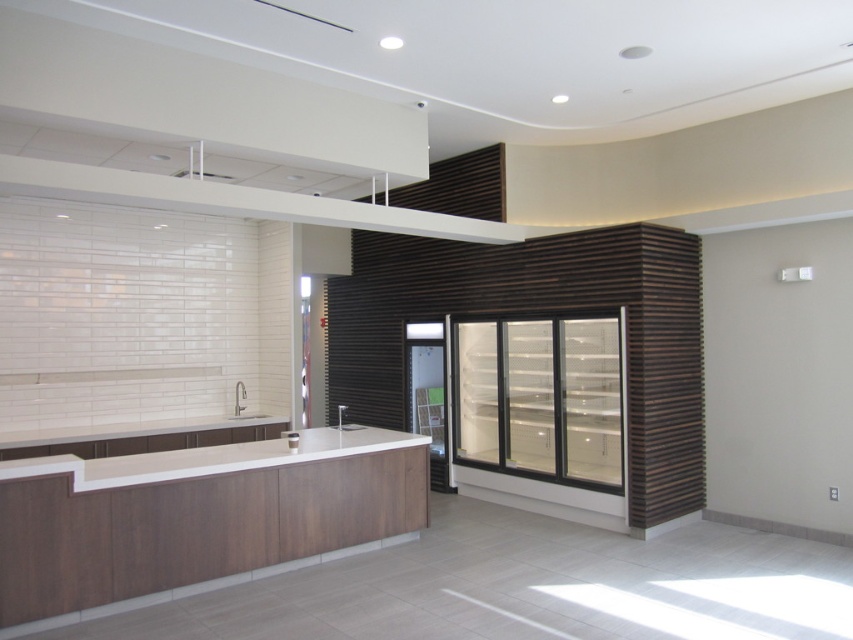
Question: Does clear glass refrigerator at center have a smaller size compared to white glossy sink at center?

Choices:
 (A) no
 (B) yes

Answer: (A)

Question: In this image, where is white matte countertop at center located relative to white glossy countertop at center?

Choices:
 (A) left
 (B) right

Answer: (A)

Question: Does white matte countertop at center appear under white glossy sink at center?

Choices:
 (A) no
 (B) yes

Answer: (B)

Question: Based on their relative distances, which object is farther from the matte white sink at center?

Choices:
 (A) white glossy countertop at center
 (B) clear glass refrigerator at center
 (C) white glossy sink at center

Answer: (A)

Question: Considering the real-world distances, which object is closest to the clear glass refrigerator at center?

Choices:
 (A) white matte countertop at center
 (B) matte white sink at center
 (C) white glossy countertop at center
 (D) white glossy sink at center

Answer: (C)

Question: Which of the following is the farthest from the observer?

Choices:
 (A) (146, 481)
 (B) (238, 413)
 (C) (517, 420)

Answer: (B)